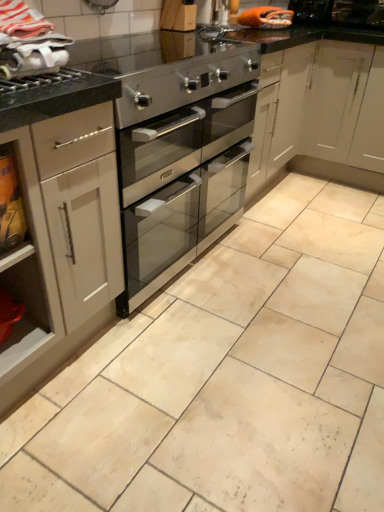
Describe the element at coordinates (40, 80) in the screenshot. Image resolution: width=384 pixels, height=512 pixels. I see `brushed metal gas stove at upper left` at that location.

The width and height of the screenshot is (384, 512). What do you see at coordinates (228, 378) in the screenshot? I see `satin silver oven at center` at bounding box center [228, 378].

In order to face stainless steel oven at upper left, should I rotate leftwards or rightwards?

Turn left by 6.406 degrees to look at stainless steel oven at upper left.

What is the approximate width of white fabric at upper left?

white fabric at upper left is 11.42 inches in width.

Image resolution: width=384 pixels, height=512 pixels. What do you see at coordinates (64, 241) in the screenshot?
I see `white matte cabinet at left` at bounding box center [64, 241].

In order to click on brushed metal gas stove at upper left in this screenshot , I will do `click(40, 80)`.

How many degrees apart are the facing directions of brushed metal gas stove at upper left and satin silver oven at center?

89.7 degrees.

From a real-world perspective, is brushed metal gas stove at upper left above or below satin silver oven at center?

Clearly, from a real-world perspective, brushed metal gas stove at upper left is above satin silver oven at center.

Is brushed metal gas stove at upper left completely or partially outside of satin silver oven at center?

Yes.

What are the coordinates of `counter below the brushed metal gas stove at upper left (from a real-world perspective)` in the screenshot? It's located at (228, 378).

From a real-world perspective, does stainless steel oven at center stand above satin silver oven at center?

Yes, from a real-world perspective, stainless steel oven at center is on top of satin silver oven at center.

Looking at this image, can you confirm if stainless steel oven at center is bigger than satin silver oven at center?

Yes.

Measure the distance between stainless steel oven at center and satin silver oven at center.

The distance of stainless steel oven at center from satin silver oven at center is 53.17 centimeters.

Is stainless steel oven at center turned away from satin silver oven at center?

No, stainless steel oven at center is not facing the opposite direction of satin silver oven at center.

Considering the positions of objects white matte cabinet at left and satin silver oven at center in the image provided, who is more to the left, white matte cabinet at left or satin silver oven at center?

white matte cabinet at left.

How many degrees apart are the facing directions of white matte cabinet at left and satin silver oven at center?

The angle between the facing direction of white matte cabinet at left and the facing direction of satin silver oven at center is 90.4 degrees.

In terms of width, does white matte cabinet at left look wider or thinner when compared to satin silver oven at center?

white matte cabinet at left is thinner than satin silver oven at center.

From the image's perspective, between satin silver oven at center and stainless steel oven at center, which one is located above?

stainless steel oven at center.

Based on the photo, looking at their sizes, would you say satin silver oven at center is wider or thinner than stainless steel oven at center?

Considering their sizes, satin silver oven at center looks broader than stainless steel oven at center.

From a real-world perspective, relative to stainless steel oven at center, is satin silver oven at center vertically above or below?

satin silver oven at center is below stainless steel oven at center.

Considering the positions of objects satin silver oven at center and stainless steel oven at center in the image provided, who is more to the right, satin silver oven at center or stainless steel oven at center?

satin silver oven at center.

Is point (208, 67) closer or farther from the camera than point (22, 88)?

Point (208, 67) is positioned farther from the camera compared to point (22, 88).

From a real-world perspective, is stainless steel oven at upper left physically located above or below brushed metal gas stove at upper left?

In terms of real-world spatial position, stainless steel oven at upper left is below brushed metal gas stove at upper left.

Which object is closer to the camera taking this photo, stainless steel oven at upper left or brushed metal gas stove at upper left?

brushed metal gas stove at upper left is in front.

Consider the image. Are stainless steel oven at upper left and brushed metal gas stove at upper left making contact?

stainless steel oven at upper left and brushed metal gas stove at upper left are not in contact.

From the image's perspective, which is above, white fabric at upper left or brushed metal gas stove at upper left?

white fabric at upper left, from the image's perspective.

Who is smaller, white fabric at upper left or brushed metal gas stove at upper left?

brushed metal gas stove at upper left.

From a real-world perspective, is white fabric at upper left over brushed metal gas stove at upper left?

Yes.

Does white fabric at upper left have a greater height compared to brushed metal gas stove at upper left?

Indeed, white fabric at upper left has a greater height compared to brushed metal gas stove at upper left.

Find the location of a particular element. Image resolution: width=384 pixels, height=512 pixels. material on the right of the white matte cabinet at left is located at coordinates (28, 42).

Considering the sizes of objects white fabric at upper left and white matte cabinet at left in the image provided, who is thinner, white fabric at upper left or white matte cabinet at left?

With smaller width is white fabric at upper left.

Would you say white fabric at upper left is a long distance from white matte cabinet at left?

That's not correct — white fabric at upper left is a little close to white matte cabinet at left.

Where is `counter below the brushed metal gas stove at upper left (from a real-world perspective)`? The image size is (384, 512). counter below the brushed metal gas stove at upper left (from a real-world perspective) is located at coordinates (228, 378).

You are a GUI agent. You are given a task and a screenshot of the screen. Output one action in this format:
    pyautogui.click(x=<x>, y=<y>)
    Task: Click on the oven on the left of satin silver oven at center
    The width and height of the screenshot is (384, 512).
    Given the screenshot: What is the action you would take?
    [x=182, y=162]

Considering their positions, is satin silver oven at center positioned closer to stainless steel oven at center than brushed metal gas stove at upper left?

satin silver oven at center.

Based on their spatial positions, is satin silver oven at center or stainless steel oven at center further from white fabric at upper left?

satin silver oven at center.

Looking at the image, which one is located closer to white fabric at upper left, brushed metal gas stove at upper left or stainless steel oven at center?

brushed metal gas stove at upper left is positioned closer to the anchor white fabric at upper left.

Looking at this image, estimate the real-world distances between objects in this image. Which object is closer to stainless steel oven at center, stainless steel oven at upper left or satin silver oven at center?

Among the two, stainless steel oven at upper left is located nearer to stainless steel oven at center.

When comparing their distances from white matte cabinet at left, does white fabric at upper left or brushed metal gas stove at upper left seem closer?

white fabric at upper left.

From the image, which object appears to be farther from white fabric at upper left, white matte cabinet at left or stainless steel oven at upper left?

stainless steel oven at upper left is further to white fabric at upper left.

When comparing their distances from stainless steel oven at center, does white fabric at upper left or stainless steel oven at upper left seem further?

Based on the image, white fabric at upper left appears to be further to stainless steel oven at center.

Which object lies nearer to the anchor point stainless steel oven at center, white matte cabinet at left or brushed metal gas stove at upper left?

The object closer to stainless steel oven at center is white matte cabinet at left.

Identify the location of material situated between white matte cabinet at left and satin silver oven at center from left to right. (28, 42).

Locate an element on the screen. The image size is (384, 512). gas stove between white matte cabinet at left and satin silver oven at center is located at coordinates (40, 80).

Image resolution: width=384 pixels, height=512 pixels. I want to click on gas stove between white fabric at upper left and white matte cabinet at left vertically, so click(40, 80).

I want to click on oven between white matte cabinet at left and satin silver oven at center, so click(x=182, y=162).